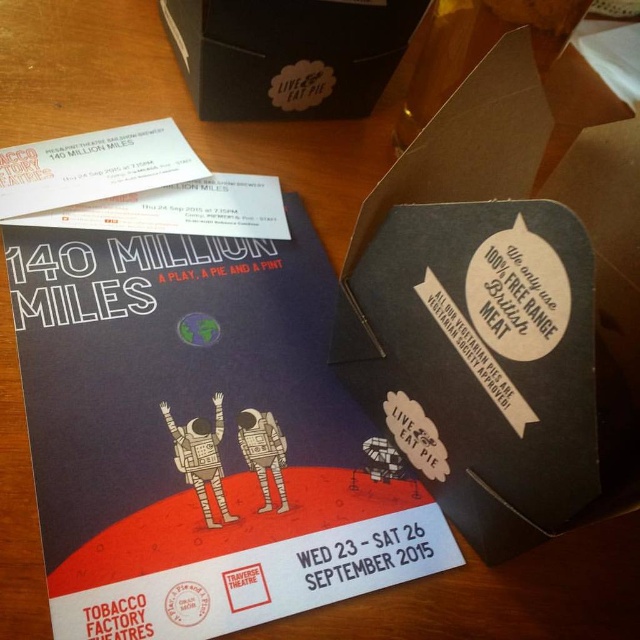
You are setting up a promotional display and need to ensure that the matte black poster at center and the matte gray astronaut at center are arranged so that the taller item is placed at the back to avoid blocking the view. Which object should be placed at the back?

The matte black poster at center should be placed at the back because it is taller than the matte gray astronaut at center, ensuring it doesn not block the view.